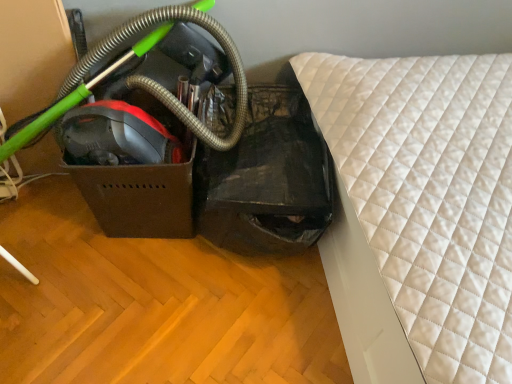
Measure the distance between green rubber garden hose at left and camera.

green rubber garden hose at left is 1.10 meters away from camera.

This screenshot has width=512, height=384. Identify the location of green rubber garden hose at left. (165, 88).

The width and height of the screenshot is (512, 384). What do you see at coordinates (165, 88) in the screenshot? I see `green rubber garden hose at left` at bounding box center [165, 88].

Identify the location of green rubber garden hose at left. [165, 88].